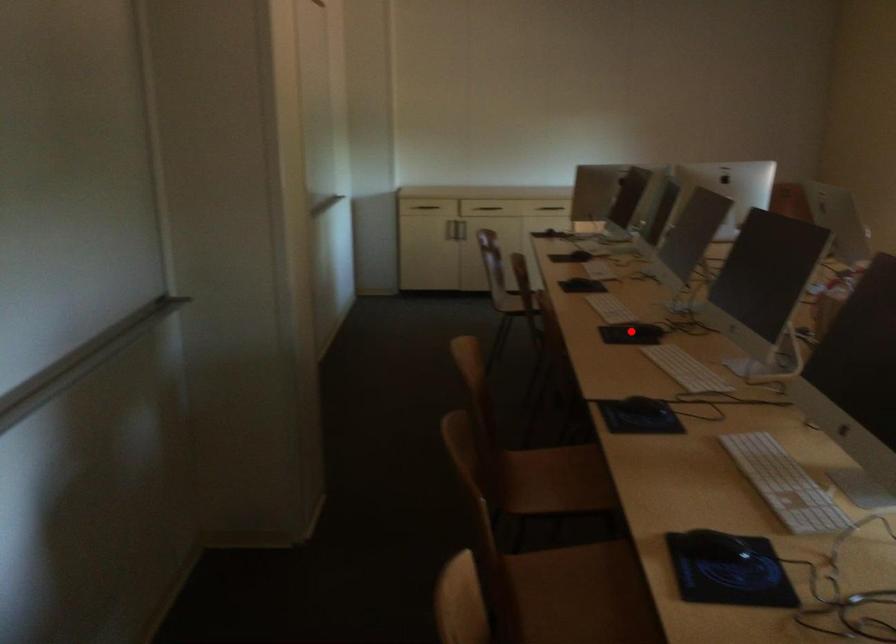
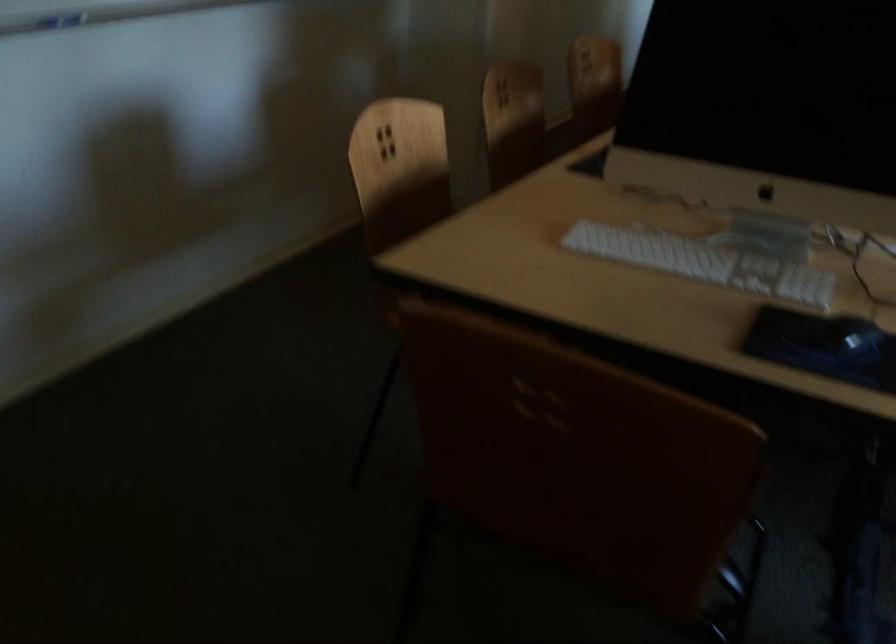
Question: I am providing you with two images of the same scene from different viewpoints. A red point is marked on the first image. Is the red point's position out of view in image 2?

Choices:
 (A) Yes
 (B) No

Answer: (A)